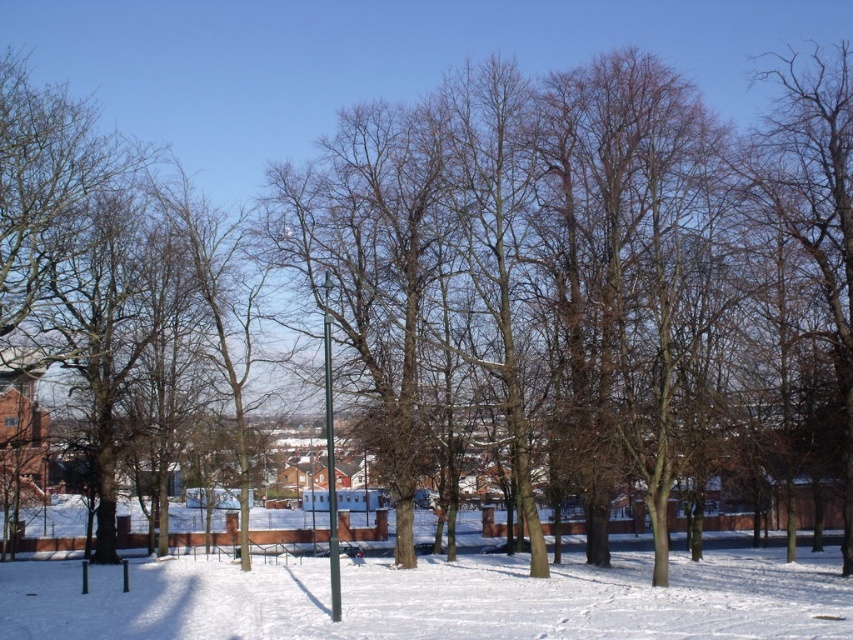
What do you see at coordinates (431, 600) in the screenshot?
I see `white powdery snow at center` at bounding box center [431, 600].

In the scene shown: Is white powdery snow at center smaller than metallic pole at center?

Incorrect, white powdery snow at center is not smaller in size than metallic pole at center.

Is point (141, 628) positioned in front of point (335, 552)?

Yes, it is.

Where is `white powdery snow at center`? The image size is (853, 640). white powdery snow at center is located at coordinates (431, 600).